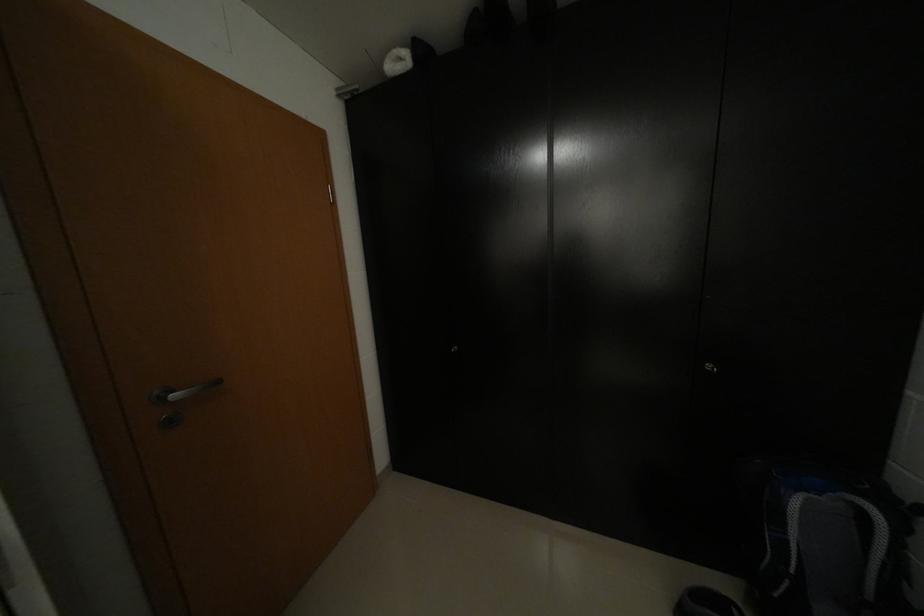
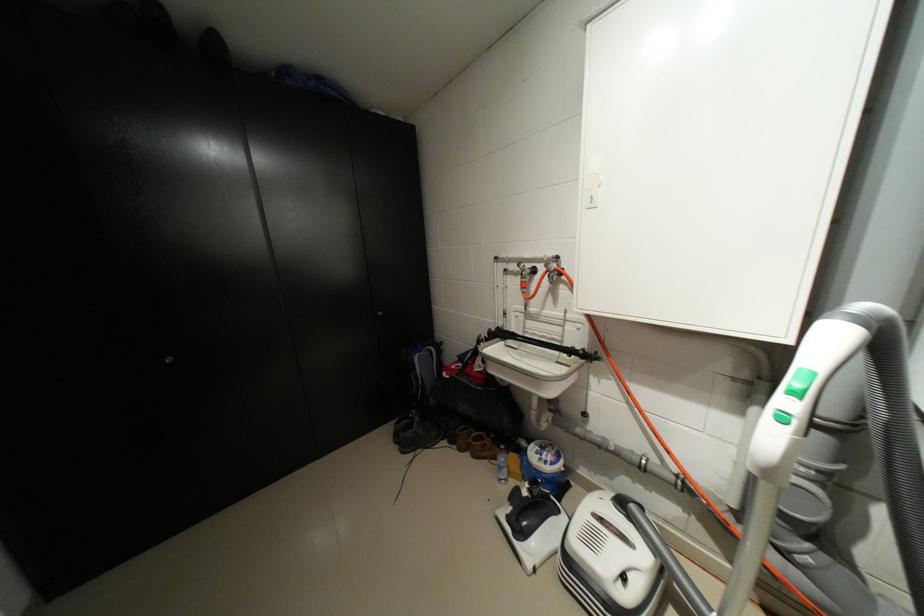
Question: The first image is from the beginning of the video and the second image is from the end. How did the camera likely rotate when shooting the video?

Choices:
 (A) Left
 (B) Right
 (C) Up
 (D) Down

Answer: (B)